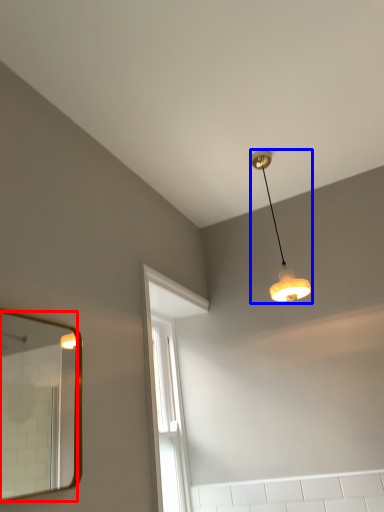
Question: Which point is closer to the camera, mirror (highlighted by a red box) or lamp (highlighted by a blue box)?

Choices:
 (A) mirror
 (B) lamp

Answer: (A)